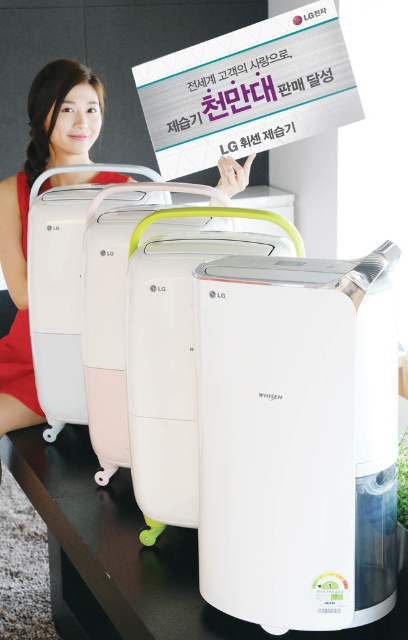
Which is behind, point (317, 12) or point (17, 316)?

The point (17, 316) is more distant.

Is white paper at upper center positioned before matte pink dress at left?

That is True.

Which is behind, point (343, 76) or point (24, 324)?

Point (24, 324)

This screenshot has height=640, width=408. I want to click on white paper at upper center, so click(x=248, y=90).

Which is behind, point (128, 515) or point (257, 148)?

Positioned behind is point (257, 148).

Can you confirm if black glossy table at center is positioned below white paper at upper center?

Indeed, black glossy table at center is positioned under white paper at upper center.

At what (x,y) coordinates should I click in order to perform the action: click on black glossy table at center. Please return your answer as a coordinate pair (x, y). The height and width of the screenshot is (640, 408). Looking at the image, I should click on (133, 556).

At what (x,y) coordinates should I click in order to perform the action: click on black glossy table at center. Please return your answer as a coordinate pair (x, y). Looking at the image, I should click on click(x=133, y=556).

Is point (79, 508) positioned after point (13, 394)?

That is False.

Find the location of a particular element. black glossy table at center is located at coordinates (133, 556).